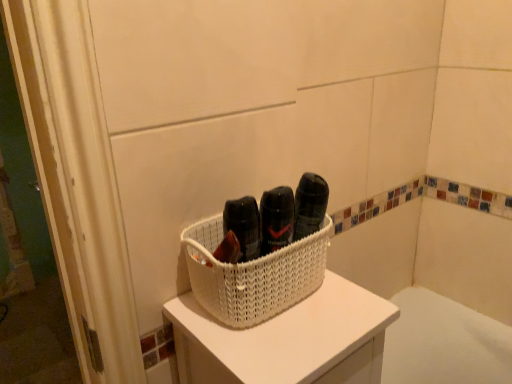
Question: Is white woven basket at center in front of or behind white woven basket at center in the image?

Choices:
 (A) front
 (B) behind

Answer: (A)

Question: Do you think white woven basket at center is within white woven basket at center, or outside of it?

Choices:
 (A) inside
 (B) outside

Answer: (B)

Question: From their relative heights in the image, would you say white woven basket at center is taller or shorter than white woven basket at center?

Choices:
 (A) tall
 (B) short

Answer: (A)

Question: Considering the positions of point (211, 279) and point (324, 281), is point (211, 279) closer or farther from the camera than point (324, 281)?

Choices:
 (A) closer
 (B) farther

Answer: (A)

Question: In terms of height, does white woven basket at center look taller or shorter compared to white woven basket at center?

Choices:
 (A) short
 (B) tall

Answer: (A)

Question: From a real-world perspective, is white woven basket at center positioned above or below white woven basket at center?

Choices:
 (A) above
 (B) below

Answer: (A)

Question: In the image, is white woven basket at center positioned in front of or behind white woven basket at center?

Choices:
 (A) front
 (B) behind

Answer: (B)